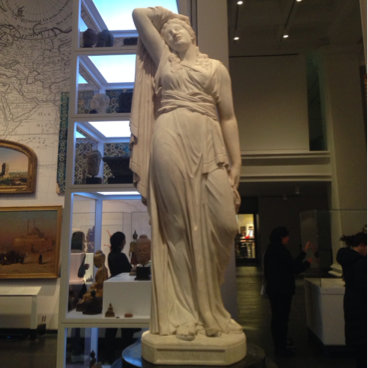
Locate an element on the screen. The image size is (368, 368). grey floor is located at coordinates (33, 339).